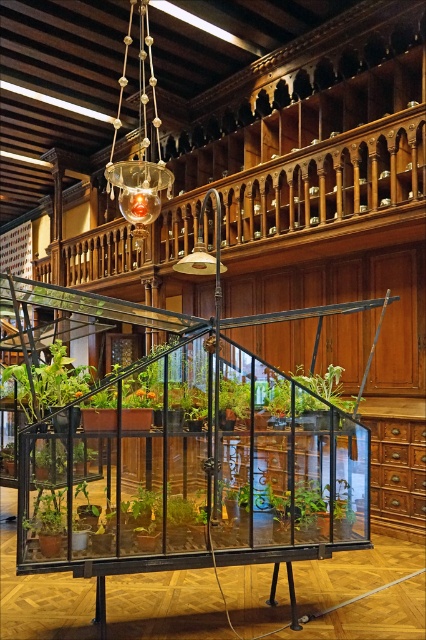
Question: Is translucent glass chandelier at upper center positioned at the back of green matte plant at lower left?

Choices:
 (A) no
 (B) yes

Answer: (B)

Question: Which object is closer to the camera taking this photo?

Choices:
 (A) green leafy plant at center
 (B) translucent glass chandelier at upper center

Answer: (A)

Question: Is translucent glass chandelier at upper center below green leafy plant at center?

Choices:
 (A) no
 (B) yes

Answer: (A)

Question: Estimate the real-world distances between objects in this image. Which object is closer to the green matte plant at center?

Choices:
 (A) green matte plant at lower left
 (B) green leafy plant at center

Answer: (B)

Question: Which point is farther to the camera?

Choices:
 (A) (45, 500)
 (B) (316, 392)

Answer: (B)

Question: Does green leafy plant at center appear on the right side of green matte plant at lower left?

Choices:
 (A) yes
 (B) no

Answer: (A)